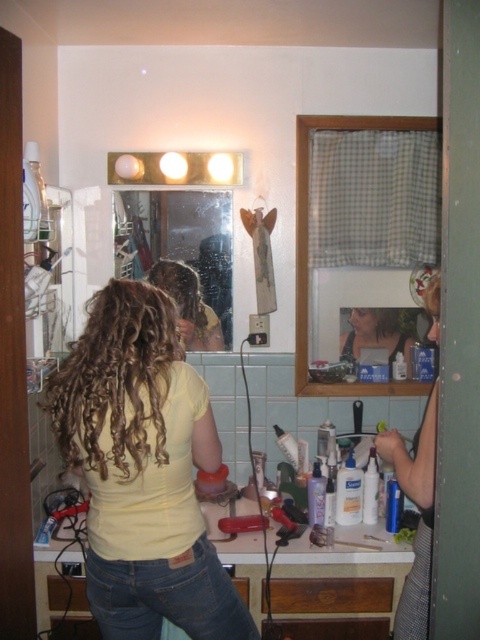
Question: Considering the real-world distances, which object is farthest from the yellow matte shirt at center?

Choices:
 (A) checkered fabric mirror at upper center
 (B) curly brown hair at center
 (C) matte plastic bottle at upper center
 (D) brown curly hair at back

Answer: (C)

Question: Can you confirm if brown curly hair at back is positioned to the right of matte plastic bottle at upper center?

Choices:
 (A) no
 (B) yes

Answer: (A)

Question: Does clear glass mirror at center have a larger size compared to curly brown hair at center?

Choices:
 (A) no
 (B) yes

Answer: (B)

Question: Does yellow matte shirt at center appear on the right side of brown curly hair at back?

Choices:
 (A) yes
 (B) no

Answer: (A)

Question: Which point is closer to the camera taking this photo?

Choices:
 (A) (408, 484)
 (B) (432, 310)

Answer: (A)

Question: Which point is closer to the camera?

Choices:
 (A) curly brown hair at center
 (B) clear glass mirror at center
 (C) matte black hairbrush at upper right

Answer: (C)